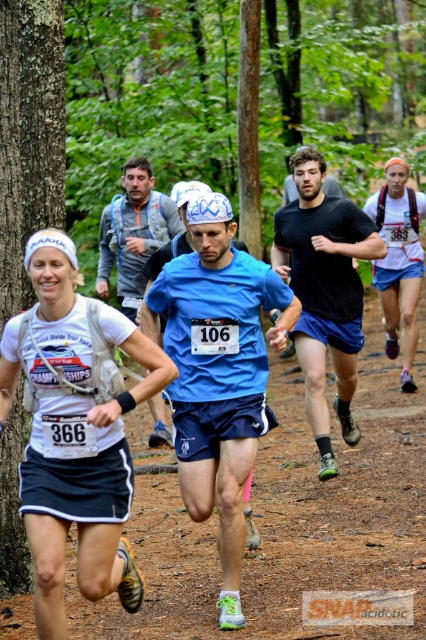
You are a photographer positioned at the starting line of the trail race. You need to capture a photo of the black matte running shoe at center and the blue fabric shirt at center. Since your camera has a limited focus range, you must know which object is closer to you. Can you determine which one is closer based on their sizes?

The black matte running shoe at center has a smaller width than the blue fabric shirt at center, so it appears closer to you since objects closer to the camera appear larger in the photo. However, since the shoe is smaller in real life, its actual size might not indicate distance. Without depth cues, it is hard to determine solely based on width.

You are an observer at the trail race. You see the white fabric shirt at left and the blue fabric shirt at center. Which shirt has a smaller width when measured across the chest?

The white fabric shirt at left has a smaller width when measured across the chest because it is thinner than the blue fabric shirt at center.

From the picture: You are a photographer positioned at the starting line of the trail race. You want to take a photo that includes both the white fabric shirt at left and the blue fabric shirt at center. Which shirt should you adjust your camera focus to first to ensure both are in sharp focus?

The white fabric shirt at left is closer to the viewer than the blue fabric shirt at center. To ensure both are in sharp focus, adjust the camera focus to the white fabric shirt at left first, as it is the closer object.